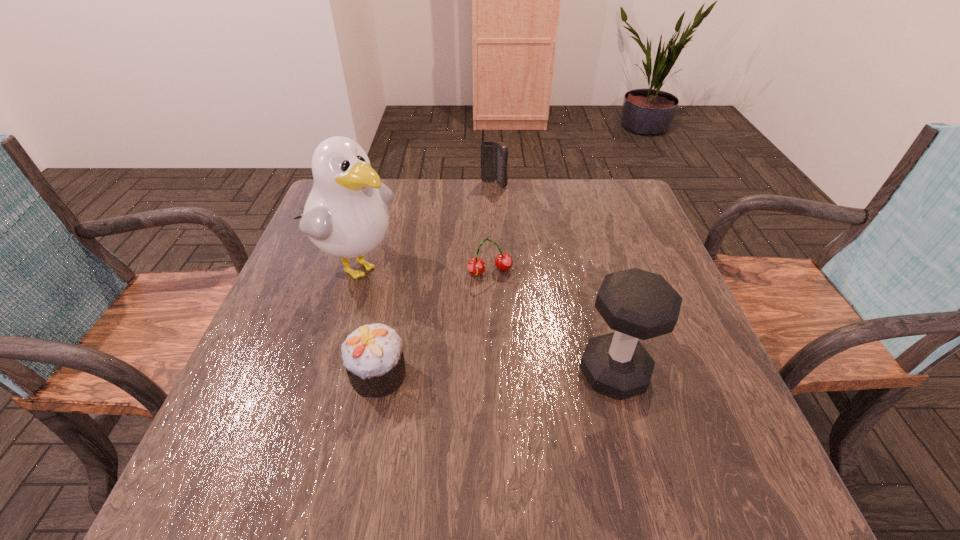
Where is `cupcake`? Image resolution: width=960 pixels, height=540 pixels. cupcake is located at coordinates (373, 356).

Locate an element on the screen. The height and width of the screenshot is (540, 960). dumbbell is located at coordinates (637, 304).

This screenshot has height=540, width=960. What are the coordinates of `the second tallest object` in the screenshot? It's located at (637, 304).

This screenshot has width=960, height=540. In order to click on gull in this screenshot , I will do `click(346, 215)`.

Locate an element on the screen. cellular telephone is located at coordinates (494, 156).

Identify the location of the farthest object. Image resolution: width=960 pixels, height=540 pixels. (494, 156).

The height and width of the screenshot is (540, 960). I want to click on cherry, so click(x=476, y=266).

Where is `blank area located 0.230m on the right of the cupcake`? Image resolution: width=960 pixels, height=540 pixels. blank area located 0.230m on the right of the cupcake is located at coordinates (527, 375).

This screenshot has width=960, height=540. What are the coordinates of `free space located 0.070m on the back of the rightmost object` in the screenshot? It's located at (600, 320).

Where is `vacant point located on the beak of the gull`? The width and height of the screenshot is (960, 540). vacant point located on the beak of the gull is located at coordinates (406, 300).